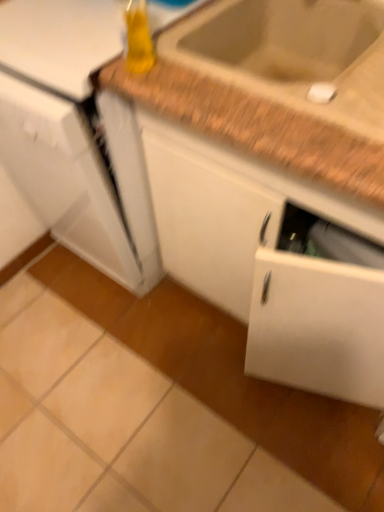
Question: Is white matte cabinet at center bigger than white glossy refrigerator at left?

Choices:
 (A) yes
 (B) no

Answer: (A)

Question: Is white matte cabinet at center outside white glossy refrigerator at left?

Choices:
 (A) yes
 (B) no

Answer: (A)

Question: Considering the relative sizes of white matte cabinet at center and white glossy refrigerator at left in the image provided, is white matte cabinet at center taller than white glossy refrigerator at left?

Choices:
 (A) no
 (B) yes

Answer: (A)

Question: From the image's perspective, is white matte cabinet at center under white glossy refrigerator at left?

Choices:
 (A) yes
 (B) no

Answer: (A)

Question: From the image's perspective, is white matte cabinet at center on white glossy refrigerator at left?

Choices:
 (A) no
 (B) yes

Answer: (A)

Question: In the image, is translucent yellow bottle at upper center on the left side or the right side of white glossy refrigerator at left?

Choices:
 (A) right
 (B) left

Answer: (A)

Question: Is translucent yellow bottle at upper center in front of or behind white glossy refrigerator at left in the image?

Choices:
 (A) behind
 (B) front

Answer: (B)

Question: From the image's perspective, is translucent yellow bottle at upper center positioned above or below white glossy refrigerator at left?

Choices:
 (A) above
 (B) below

Answer: (A)

Question: Is point (134, 58) positioned closer to the camera than point (117, 31)?

Choices:
 (A) closer
 (B) farther

Answer: (A)

Question: From the image's perspective, is brown speckled granite at upper right positioned above or below white glossy refrigerator at left?

Choices:
 (A) below
 (B) above

Answer: (B)

Question: Based on their positions, is brown speckled granite at upper right located to the left or right of white glossy refrigerator at left?

Choices:
 (A) right
 (B) left

Answer: (A)

Question: Choose the correct answer: Is brown speckled granite at upper right inside white glossy refrigerator at left or outside it?

Choices:
 (A) inside
 (B) outside

Answer: (B)

Question: Is point (263, 116) positioned closer to the camera than point (137, 234)?

Choices:
 (A) farther
 (B) closer

Answer: (B)

Question: Do you think brown speckled granite at upper right is within translucent yellow bottle at upper center, or outside of it?

Choices:
 (A) inside
 (B) outside

Answer: (B)

Question: Considering the positions of point (233, 31) and point (127, 64), is point (233, 31) closer or farther from the camera than point (127, 64)?

Choices:
 (A) closer
 (B) farther

Answer: (B)